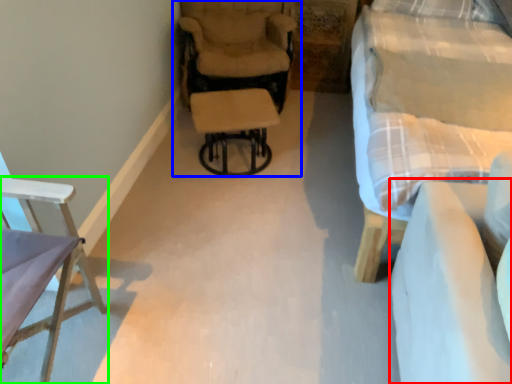
Question: Based on their relative distances, which object is nearer to couch (highlighted by a red box)? Choose from chair (highlighted by a blue box) and chair (highlighted by a green box).

Choices:
 (A) chair
 (B) chair

Answer: (B)